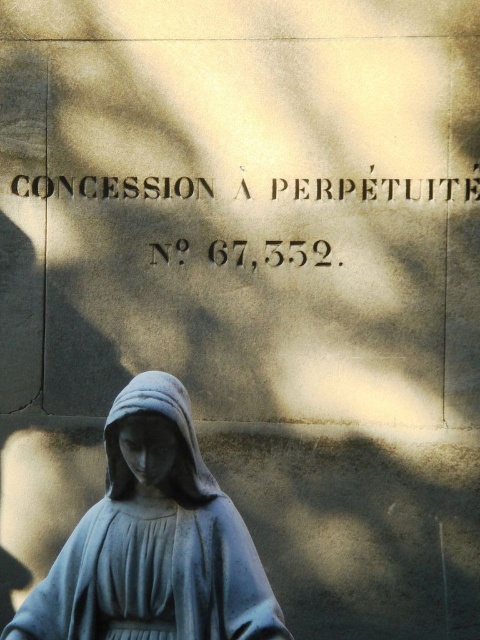
Who is more distant from viewer, (192,496) or (248,196)?

The point (248,196) is behind.

Does point (203, 484) come farther from viewer compared to point (224, 257)?

No.

Find the location of `gray stone statue at lower center`. gray stone statue at lower center is located at coordinates (154, 541).

Describe the element at coordinates (376, 189) in the screenshot. This screenshot has height=640, width=480. I see `dark gray stone inscription at upper center` at that location.

Can you confirm if dark gray stone inscription at upper center is thinner than gray stone statue at center?

In fact, dark gray stone inscription at upper center might be wider than gray stone statue at center.

Who is more forward, (412,195) or (144,387)?

Point (144,387) is more forward.

This screenshot has width=480, height=640. I want to click on dark gray stone inscription at upper center, so click(376, 189).

Does gray stone statue at lower center appear on the left side of gray stone statue at center?

Yes, gray stone statue at lower center is to the left of gray stone statue at center.

Does gray stone statue at lower center have a lesser width compared to gray stone statue at center?

Incorrect, gray stone statue at lower center's width is not less than gray stone statue at center's.

Does point (104, 634) come closer to viewer compared to point (180, 452)?

No, (104, 634) is behind (180, 452).

Identify the location of gray stone statue at lower center. The image size is (480, 640). (154, 541).